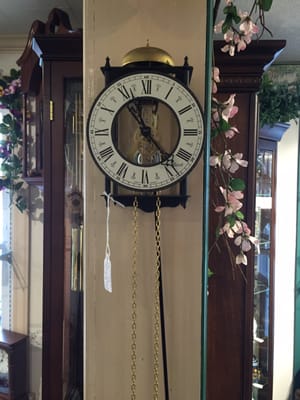
Find the location of a particular element. plant is located at coordinates tap(272, 106).